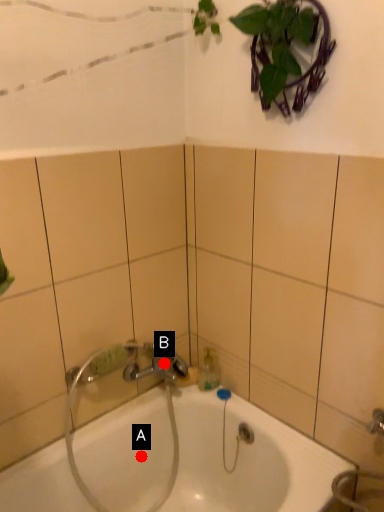
Question: Two points are circled on the image, labeled by A and B beside each circle. Which point is closer to the camera?

Choices:
 (A) A is closer
 (B) B is closer

Answer: (A)